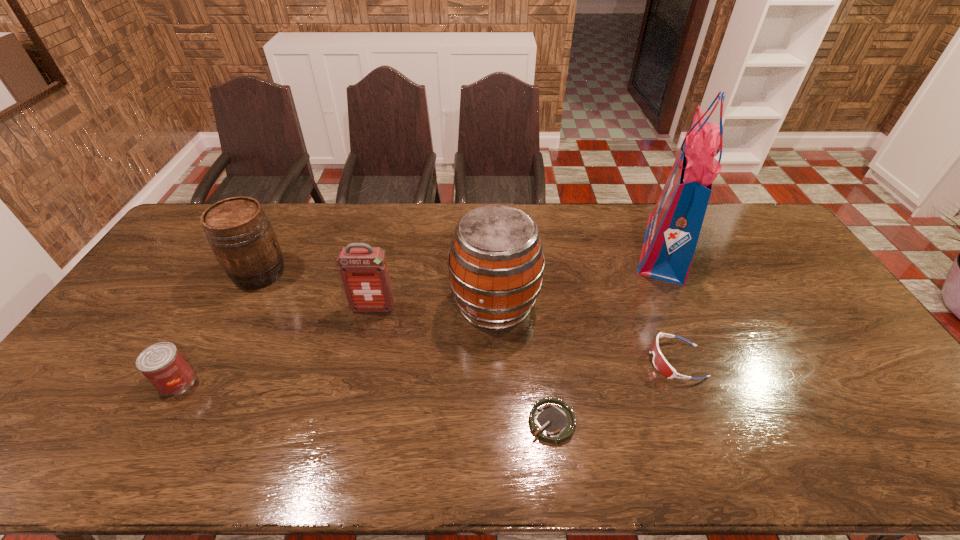
What are the coordinates of `free space between the second tallest object and the third shortest object` in the screenshot? It's located at (336, 343).

This screenshot has height=540, width=960. In order to click on vacant space that's between the right cider and the can in this screenshot , I will do `click(336, 343)`.

Find the location of a particular element. This screenshot has height=540, width=960. free space between the shorter cider and the shortest object is located at coordinates (406, 348).

This screenshot has height=540, width=960. I want to click on object that is the fifth closest one to the goggles, so click(239, 232).

Select which object appears as the fifth closest to the second shortest object. Please provide its 2D coordinates. Your answer should be formatted as a tuple, i.e. [(x, y)], where the tuple contains the x and y coordinates of a point satisfying the conditions above.

[(239, 232)]

At what (x,y) coordinates should I click in order to perform the action: click on free point that satisfies the following two spatial constraints: 1. on the side of the shorter cider near the bung hole; 2. on the right side of the taller cider. Please return your answer as a coordinate pair (x, y). The height and width of the screenshot is (540, 960). Looking at the image, I should click on (243, 305).

Identify the location of free space that satisfies the following two spatial constraints: 1. on the front-facing side of the tallest object; 2. on the front side of the shortest object. This screenshot has height=540, width=960. (749, 422).

Image resolution: width=960 pixels, height=540 pixels. I want to click on vacant position in the image that satisfies the following two spatial constraints: 1. on the front-facing side of the grocery bag; 2. on the front-facing side of the fifth object from right to left, so click(x=695, y=308).

The height and width of the screenshot is (540, 960). Find the location of `vacant space that satisfies the following two spatial constraints: 1. on the side of the left cider near the bung hole; 2. on the back side of the right cider`. vacant space that satisfies the following two spatial constraints: 1. on the side of the left cider near the bung hole; 2. on the back side of the right cider is located at coordinates (243, 305).

This screenshot has width=960, height=540. Identify the location of blank space that satisfies the following two spatial constraints: 1. on the side of the left cider near the bung hole; 2. on the left side of the shortest object. coord(182,422).